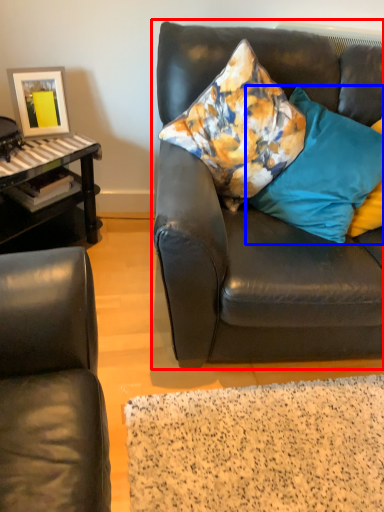
Question: Among these objects, which one is farthest to the camera, studio couch (highlighted by a red box) or pillow (highlighted by a blue box)?

Choices:
 (A) studio couch
 (B) pillow

Answer: (B)